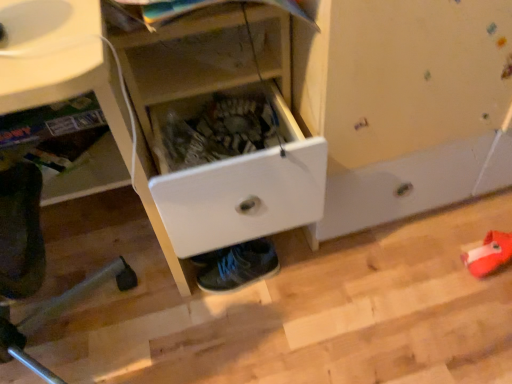
Identify the location of unoccupied area in front of shiny blue sneakers at lower center. pos(246,329).